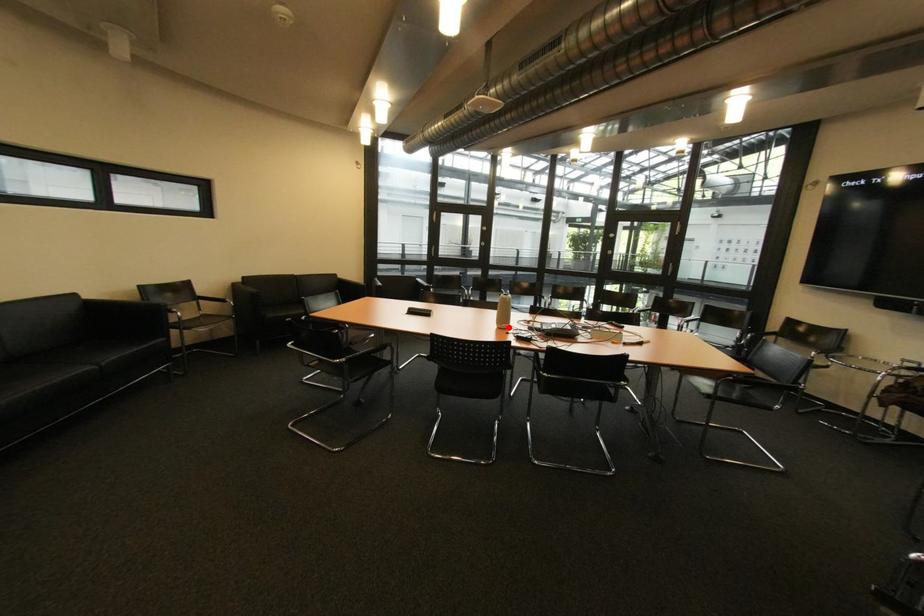
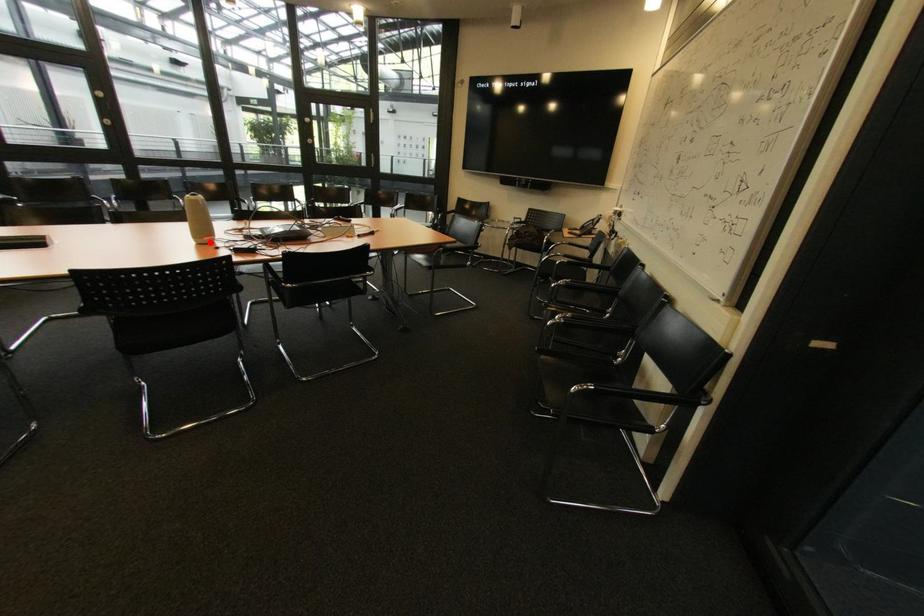
I am providing you with two images of the same scene from different viewpoints. A red point is marked on the first image and another point is marked on the second image. Is the marked point in image1 the same physical position as the marked point in image2?

Yes